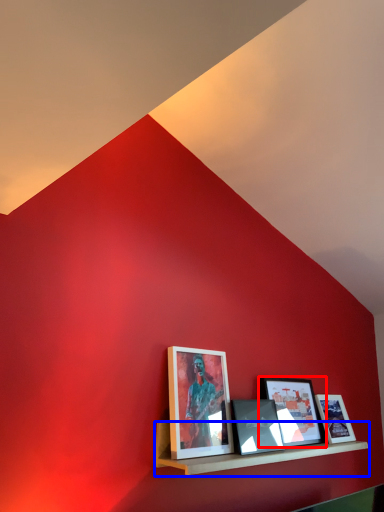
Question: Among these objects, which one is farthest to the camera, picture frame (highlighted by a red box) or shelf (highlighted by a blue box)?

Choices:
 (A) picture frame
 (B) shelf

Answer: (A)